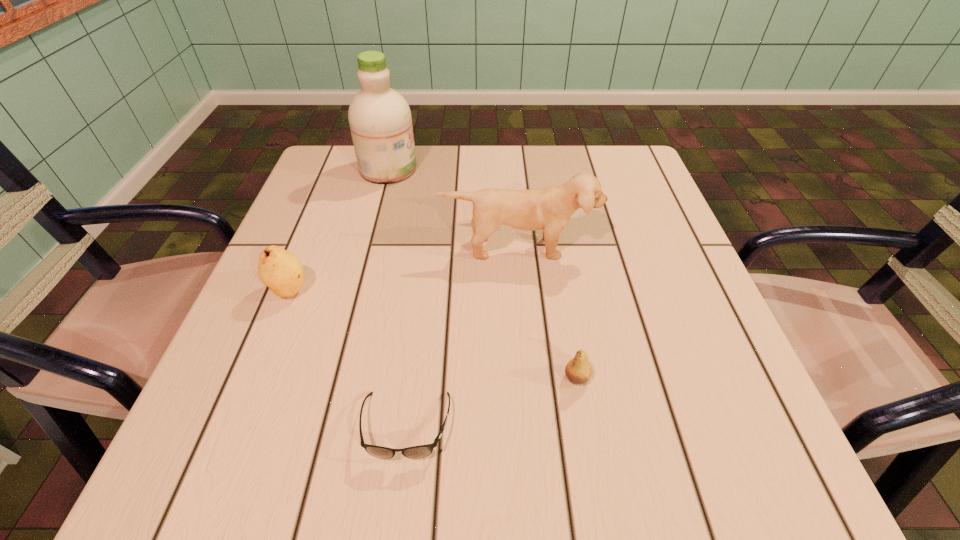
The image size is (960, 540). What are the coordinates of `the tallest object` in the screenshot? It's located at (380, 121).

Locate an element on the screen. This screenshot has width=960, height=540. the farthest object is located at coordinates (380, 121).

Locate an element on the screen. the fourth nearest object is located at coordinates (549, 208).

Locate an element on the screen. The image size is (960, 540). puppy is located at coordinates (549, 208).

This screenshot has width=960, height=540. In order to click on the left pear in this screenshot , I will do `click(280, 270)`.

Where is `the third farthest object`? the third farthest object is located at coordinates (280, 270).

Where is `the right pear`? the right pear is located at coordinates (578, 370).

At what (x,y) coordinates should I click in order to perform the action: click on the nearer pear. Please return your answer as a coordinate pair (x, y). This screenshot has height=540, width=960. Looking at the image, I should click on (578, 370).

Where is `the shortest object`? Image resolution: width=960 pixels, height=540 pixels. the shortest object is located at coordinates (416, 452).

What are the coordinates of `the nearest object` in the screenshot? It's located at pyautogui.click(x=416, y=452).